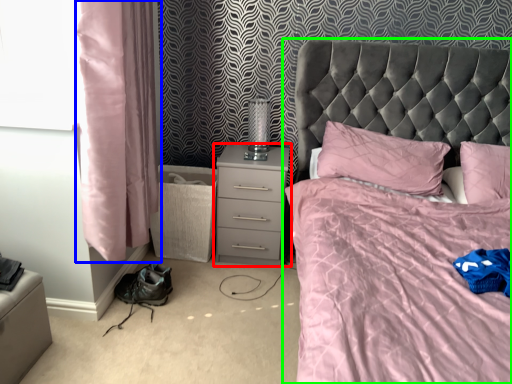
Question: Based on their relative distances, which object is farther from nightstand (highlighted by a red box)? Choose from curtain (highlighted by a blue box) and bed (highlighted by a green box).

Choices:
 (A) curtain
 (B) bed

Answer: (A)